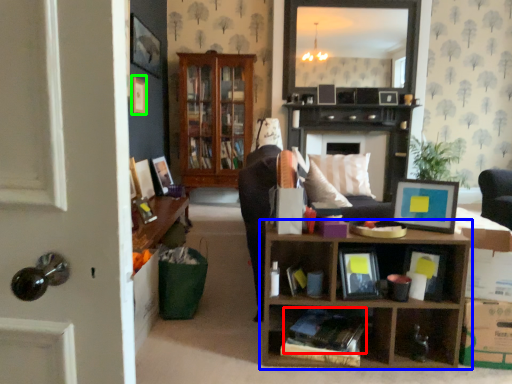
Question: Which is nearer to the book (highlighted by a red box)? shelf (highlighted by a blue box) or picture frame (highlighted by a green box).

Choices:
 (A) shelf
 (B) picture frame

Answer: (A)